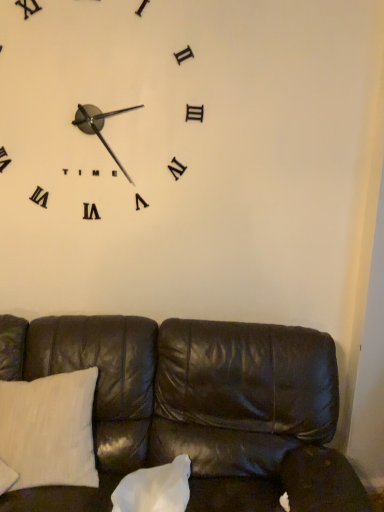
Question: Is white matte clock at upper left inside or outside of leather couch at lower center?

Choices:
 (A) inside
 (B) outside

Answer: (B)

Question: Looking at their shapes, would you say white matte clock at upper left is wider or thinner than leather couch at lower center?

Choices:
 (A) thin
 (B) wide

Answer: (A)

Question: Based on their relative distances, which object is nearer to the leather couch at lower center?

Choices:
 (A) white cotton pillow at lower left, the 2th pillow in the right-to-left sequence
 (B) white matte pillow at center, which is the 1th pillow in right-to-left order
 (C) white matte clock at upper left

Answer: (A)

Question: Estimate the real-world distances between objects in this image. Which object is farther from the white matte clock at upper left?

Choices:
 (A) white matte pillow at center, which is the 1th pillow in right-to-left order
 (B) white cotton pillow at lower left, the 2th pillow in the right-to-left sequence
 (C) leather couch at lower center

Answer: (A)